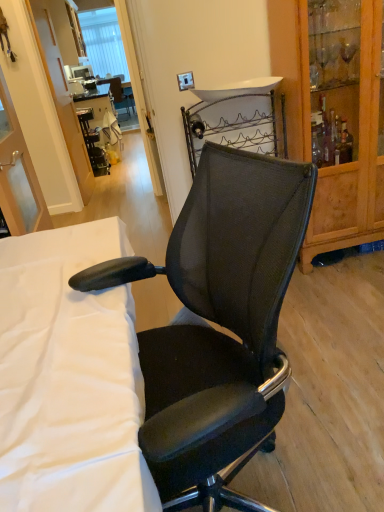
Question: Is wooden cabinet at right to the right of white fabric at center from the viewer's perspective?

Choices:
 (A) yes
 (B) no

Answer: (A)

Question: From the image's perspective, is wooden cabinet at right located beneath white fabric at center?

Choices:
 (A) no
 (B) yes

Answer: (A)

Question: Is wooden cabinet at right turned away from white fabric at center?

Choices:
 (A) yes
 (B) no

Answer: (B)

Question: From a real-world perspective, is wooden cabinet at right located beneath white fabric at center?

Choices:
 (A) no
 (B) yes

Answer: (A)

Question: From the image's perspective, is wooden cabinet at right on white fabric at center?

Choices:
 (A) yes
 (B) no

Answer: (A)

Question: Is wooden cabinet at right with white fabric at center?

Choices:
 (A) yes
 (B) no

Answer: (B)

Question: From a real-world perspective, is white fabric at center below black mesh office chair at center?

Choices:
 (A) no
 (B) yes

Answer: (B)

Question: Is white fabric at center at the right side of black mesh office chair at center?

Choices:
 (A) yes
 (B) no

Answer: (B)

Question: Is white fabric at center looking in the opposite direction of black mesh office chair at center?

Choices:
 (A) no
 (B) yes

Answer: (B)

Question: Can you confirm if white fabric at center is taller than black mesh office chair at center?

Choices:
 (A) yes
 (B) no

Answer: (B)

Question: Considering the relative sizes of white fabric at center and black mesh office chair at center in the image provided, is white fabric at center thinner than black mesh office chair at center?

Choices:
 (A) yes
 (B) no

Answer: (B)

Question: From the image's perspective, is white fabric at center beneath black mesh office chair at center?

Choices:
 (A) yes
 (B) no

Answer: (A)

Question: Is black mesh office chair at center at the left side of black plastic table at center?

Choices:
 (A) no
 (B) yes

Answer: (A)